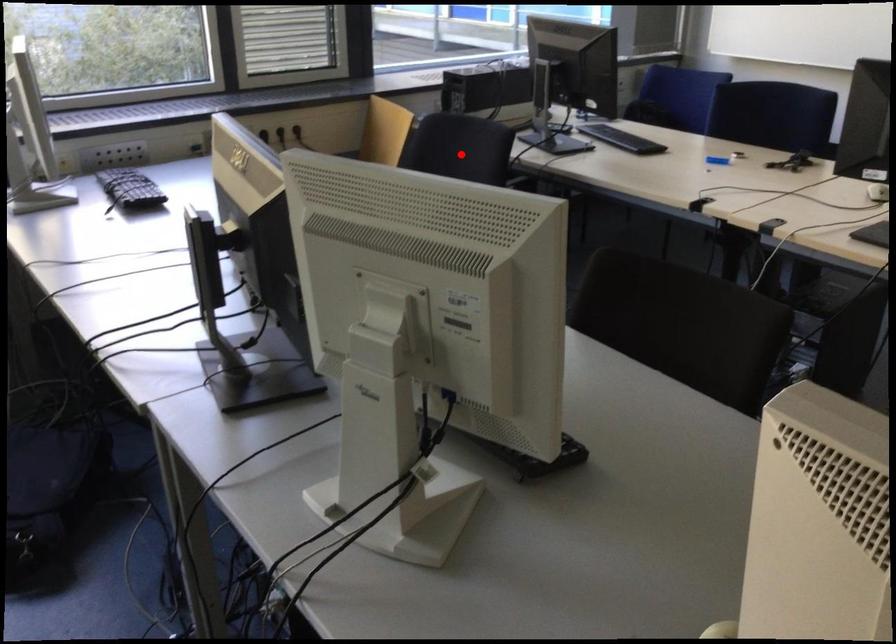
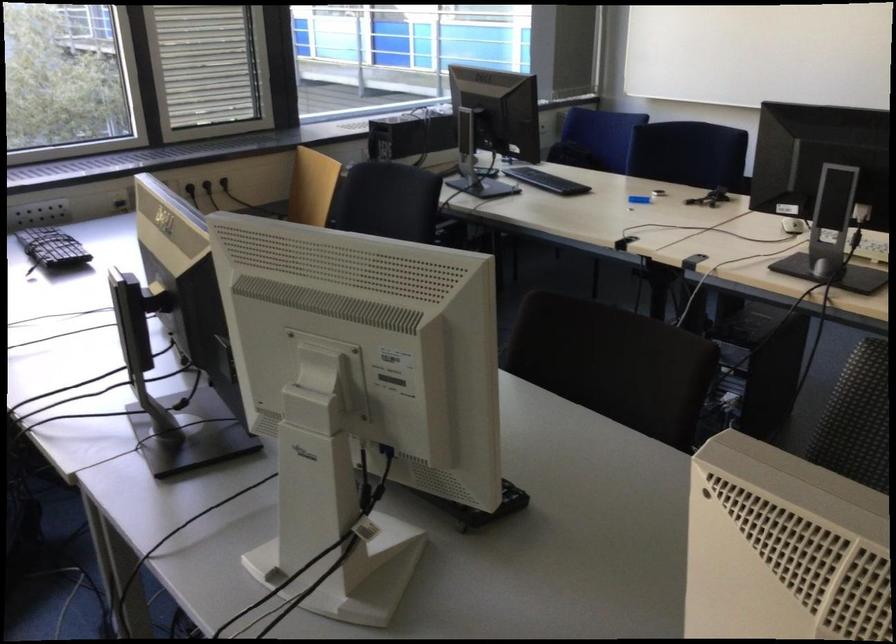
In the second image, find the point that corresponds to the highlighted location in the first image.

(391, 201)